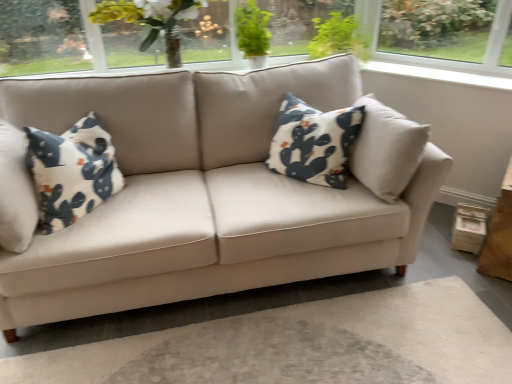
Describe the element at coordinates (252, 30) in the screenshot. I see `green leafy plant at upper center` at that location.

The height and width of the screenshot is (384, 512). In order to click on translucent glass vase at upper center in this screenshot , I will do `click(156, 27)`.

Is translucent glass vase at upper center completely or partially inside green leafy plant at upper center?

No, translucent glass vase at upper center is located outside of green leafy plant at upper center.

Is the position of green leafy plant at upper center less distant than that of translucent glass vase at upper center?

No.

Between point (261, 26) and point (170, 1), which one is positioned behind?

The point (261, 26) is farther from the camera.

Locate an element on the screen. This screenshot has width=512, height=384. floral arrangement on the left of wooden table at lower right is located at coordinates (156, 27).

Is translucent glass vase at upper center far from wooden table at lower right?

Absolutely, translucent glass vase at upper center is distant from wooden table at lower right.

From the picture: Is translucent glass vase at upper center wider than wooden table at lower right?

No.

Considering the relative sizes of translucent glass vase at upper center and wooden table at lower right in the image provided, is translucent glass vase at upper center shorter than wooden table at lower right?

Indeed, translucent glass vase at upper center has a lesser height compared to wooden table at lower right.

Is wooden table at lower right closer to the viewer compared to green leafy plant at upper center?

Yes.

Looking at this image, is wooden table at lower right to the left of green leafy plant at upper center from the viewer's perspective?

No.

Is wooden table at lower right far away from green leafy plant at upper center?

Yes, wooden table at lower right is far from green leafy plant at upper center.

Considering the relative sizes of wooden table at lower right and green leafy plant at upper center in the image provided, is wooden table at lower right shorter than green leafy plant at upper center?

In fact, wooden table at lower right may be taller than green leafy plant at upper center.

What are the coordinates of `plant above the wooden table at lower right (from the image's perspective)` in the screenshot? It's located at (x=252, y=30).

From a real-world perspective, is green leafy plant at upper center over wooden table at lower right?

Yes.

Could wooden table at lower right be considered to be inside green leafy plant at upper center?

No.

Considering the relative positions of wooden table at lower right and translucent glass vase at upper center in the image provided, is wooden table at lower right in front of translucent glass vase at upper center?

Yes, wooden table at lower right is closer to the viewer.

Is wooden table at lower right far away from translucent glass vase at upper center?

Yes, wooden table at lower right and translucent glass vase at upper center are located far from each other.

How distant is wooden table at lower right from translucent glass vase at upper center?

6.63 feet.

Could you tell me if wooden table at lower right is turned towards translucent glass vase at upper center?

No, wooden table at lower right is not facing towards translucent glass vase at upper center.

Is translucent glass vase at upper center aimed at green leafy plant at upper center?

No.

Between translucent glass vase at upper center and green leafy plant at upper center, which one is positioned in front?

translucent glass vase at upper center is closer to the camera.

Is translucent glass vase at upper center completely or partially outside of green leafy plant at upper center?

Yes, translucent glass vase at upper center is outside of green leafy plant at upper center.

In the image, there is a translucent glass vase at upper center. Identify the location of plant above it (from the image's perspective). Image resolution: width=512 pixels, height=384 pixels. pos(252,30).

Where is `table below the translucent glass vase at upper center (from the image's perspective)`? Image resolution: width=512 pixels, height=384 pixels. table below the translucent glass vase at upper center (from the image's perspective) is located at coordinates (499, 235).

Consider the image. Which object lies nearer to the anchor point wooden table at lower right, translucent glass vase at upper center or green leafy plant at upper center?

green leafy plant at upper center.

Considering their positions, is wooden table at lower right positioned further to translucent glass vase at upper center than green leafy plant at upper center?

wooden table at lower right lies further to translucent glass vase at upper center than the other object.

Looking at the image, which one is located further to wooden table at lower right, green leafy plant at upper center or translucent glass vase at upper center?

translucent glass vase at upper center lies further to wooden table at lower right than the other object.

From the image, which object appears to be farther from green leafy plant at upper center, wooden table at lower right or translucent glass vase at upper center?

wooden table at lower right is further to green leafy plant at upper center.

In the scene shown: From the image, which object appears to be nearer to translucent glass vase at upper center, green leafy plant at upper center or wooden table at lower right?

Among the two, green leafy plant at upper center is located nearer to translucent glass vase at upper center.

Looking at this image, when comparing their distances from green leafy plant at upper center, does translucent glass vase at upper center or wooden table at lower right seem further?

Among the two, wooden table at lower right is located further to green leafy plant at upper center.

The image size is (512, 384). Identify the location of plant situated between translucent glass vase at upper center and wooden table at lower right from left to right. (252, 30).